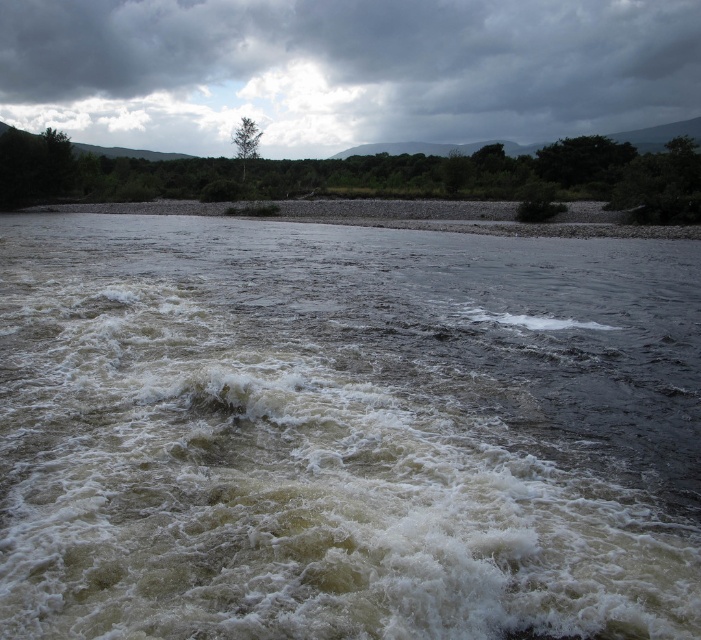
Based on the photo, you are a hiker trying to cross the river at the point marked by point (x=564, y=305) and point (x=580, y=193). Which point should you avoid due to being closer to the turbulent waters?

Point (x=564, y=305) is in front of point (x=580, y=193), so it is closer to the turbulent waters. Therefore, you should avoid point (x=564, y=305).

You are an observer looking at the river scene. You notice the cloudy sky at upper center and the green leafy tree at upper center. Which object is located higher in the image?

The cloudy sky at upper center is positioned over the green leafy tree at upper center, so it is higher in the image.